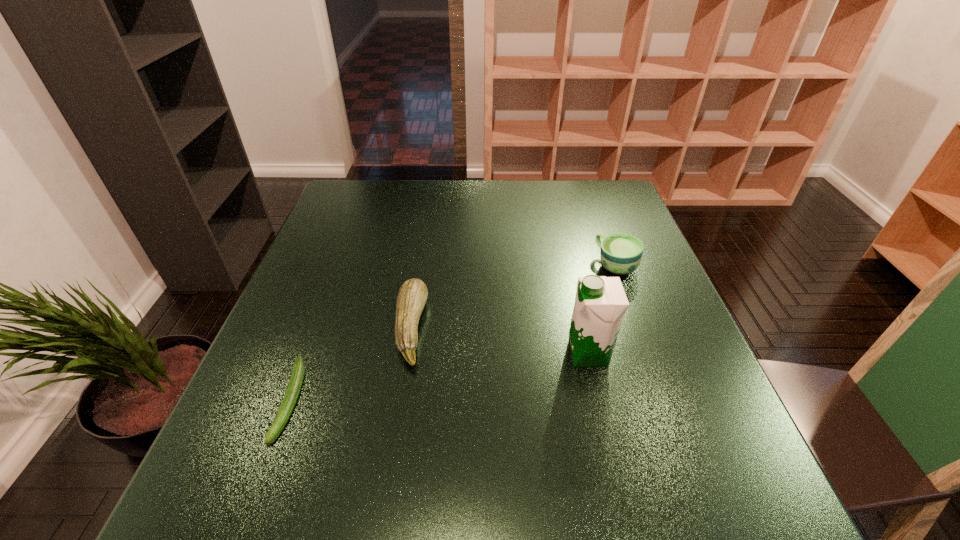
At what (x,y) coordinates should I click in order to perform the action: click on free spot at the far left corner of the desktop. Please return your answer as a coordinate pair (x, y). The image size is (960, 540). Looking at the image, I should click on pyautogui.click(x=346, y=183).

At what (x,y) coordinates should I click in order to perform the action: click on vacant space at the far right corner of the desktop. Please return your answer as a coordinate pair (x, y). This screenshot has height=540, width=960. Looking at the image, I should click on (628, 210).

This screenshot has width=960, height=540. I want to click on vacant point located between the farthest object and the left zucchini, so click(x=453, y=333).

Find the location of `unoccupied position between the leftmost object and the second object from right to left`. unoccupied position between the leftmost object and the second object from right to left is located at coordinates (440, 377).

At what (x,y) coordinates should I click in order to perform the action: click on empty location between the tallest object and the left zucchini. Please return your answer as a coordinate pair (x, y). The width and height of the screenshot is (960, 540). Looking at the image, I should click on (440, 377).

What are the coordinates of `vacant space that is in between the cup and the taller zucchini` in the screenshot? It's located at (514, 296).

Where is `unoccupied area between the shorter zucchini and the third object from left to right`? unoccupied area between the shorter zucchini and the third object from left to right is located at coordinates (440, 377).

What are the coordinates of `vacant region between the farthest object and the second shortest object` in the screenshot? It's located at (514, 296).

The width and height of the screenshot is (960, 540). In order to click on vacant space that's between the leftmost object and the third object from right to left in this screenshot , I will do `click(350, 364)`.

Identify the location of vacant area between the third tallest object and the leftmost object. (350, 364).